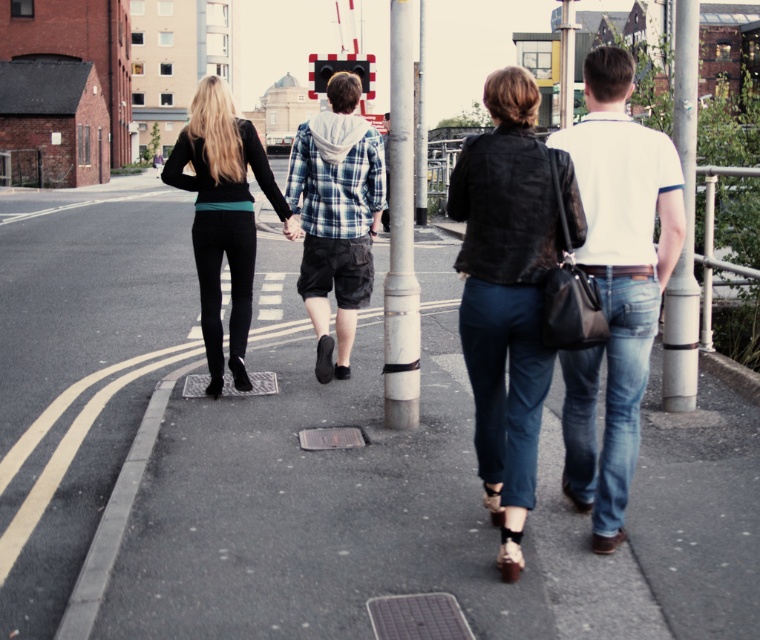
Can you confirm if smooth asphalt road at center is wider than black matte leggings at left?

Yes.

What do you see at coordinates (306, 460) in the screenshot?
I see `smooth asphalt road at center` at bounding box center [306, 460].

Who is more forward, [363,461] or [228,362]?

Positioned in front is point [363,461].

Where is `smooth asphalt road at center`? smooth asphalt road at center is located at coordinates (306, 460).

The width and height of the screenshot is (760, 640). What do you see at coordinates (336, 216) in the screenshot?
I see `blue plaid shirt at center` at bounding box center [336, 216].

Based on the photo, can you confirm if blue plaid shirt at center is smaller than white painted metal pole at center?

Incorrect, blue plaid shirt at center is not smaller in size than white painted metal pole at center.

You are a GUI agent. You are given a task and a screenshot of the screen. Output one action in this format:
    pyautogui.click(x=<x>, y=<y>)
    Task: Click on the blue plaid shirt at center
    
    Given the screenshot: What is the action you would take?
    pyautogui.click(x=336, y=216)

Which is in front, point (336, 124) or point (682, 145)?

Point (682, 145) is in front.

Does point (363, 161) come closer to viewer compared to point (686, 157)?

No, it is behind (686, 157).

Which is in front, point (315, 198) or point (673, 276)?

Point (673, 276) is in front.

The image size is (760, 640). What are the coordinates of `blue plaid shirt at center` in the screenshot? It's located at (336, 216).